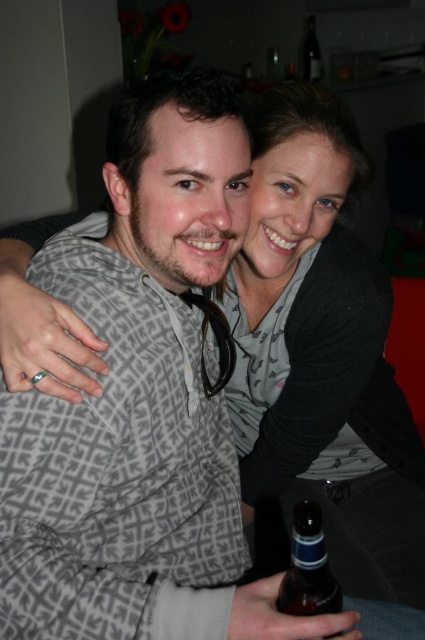
Does brown glass bottle at lower center have a larger size compared to transparent glass bottle at upper center?

Incorrect, brown glass bottle at lower center is not larger than transparent glass bottle at upper center.

In the scene shown: Is brown glass bottle at lower center taller than transparent glass bottle at upper center?

No.

Who is more forward, (339, 632) or (306, 52)?

Point (339, 632)

Locate an element on the screen. brown glass bottle at lower center is located at coordinates (308, 566).

Is matte gray sweater at center thinner than brown glass bottle at lower center?

In fact, matte gray sweater at center might be wider than brown glass bottle at lower center.

Does matte gray sweater at center appear over brown glass bottle at lower center?

Indeed, matte gray sweater at center is positioned over brown glass bottle at lower center.

This screenshot has height=640, width=425. What are the coordinates of `matte gray sweater at center` in the screenshot? It's located at [x=320, y=353].

Which of these two, matte gray sweater at center or transparent glass bottle at upper center, stands taller?

With more height is matte gray sweater at center.

Does matte gray sweater at center appear on the right side of transparent glass bottle at upper center?

In fact, matte gray sweater at center is to the left of transparent glass bottle at upper center.

Is point (272, 131) positioned in front of point (314, 64)?

Yes, point (272, 131) is in front of point (314, 64).

Locate an element on the screen. Image resolution: width=425 pixels, height=640 pixels. matte gray sweater at center is located at coordinates (320, 353).